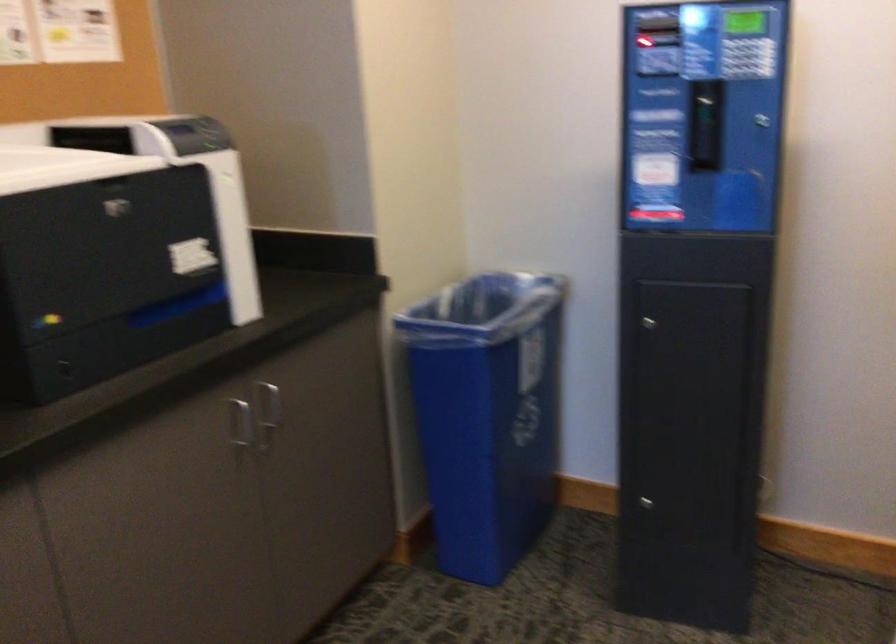
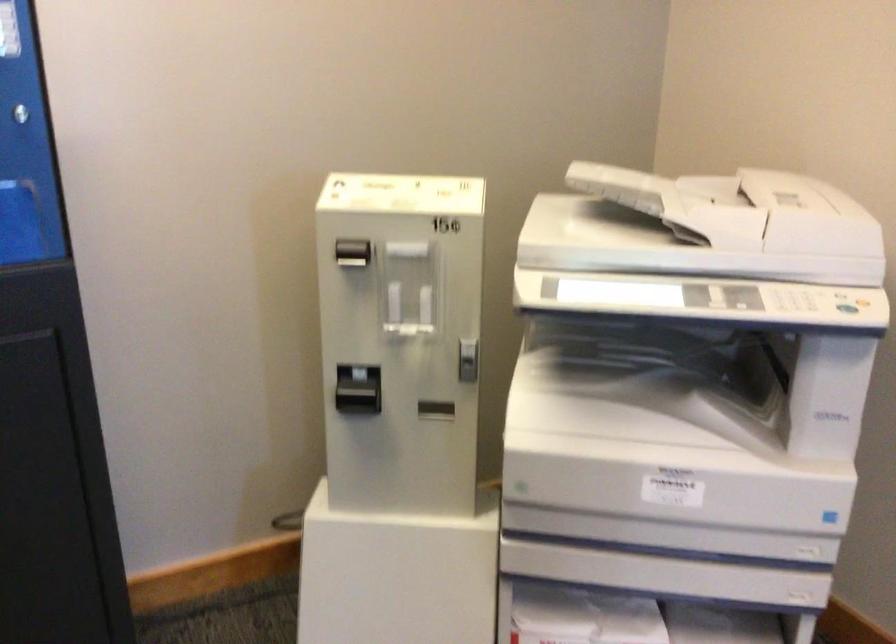
Question: Based on the continuous images, in which direction is the camera rotating? Reply with the corresponding letter.

Choices:
 (A) Left
 (B) Right
 (C) Up
 (D) Down

Answer: (B)